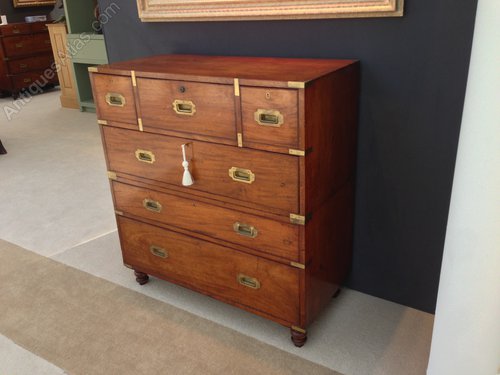
Identify the location of handle. (143, 155).